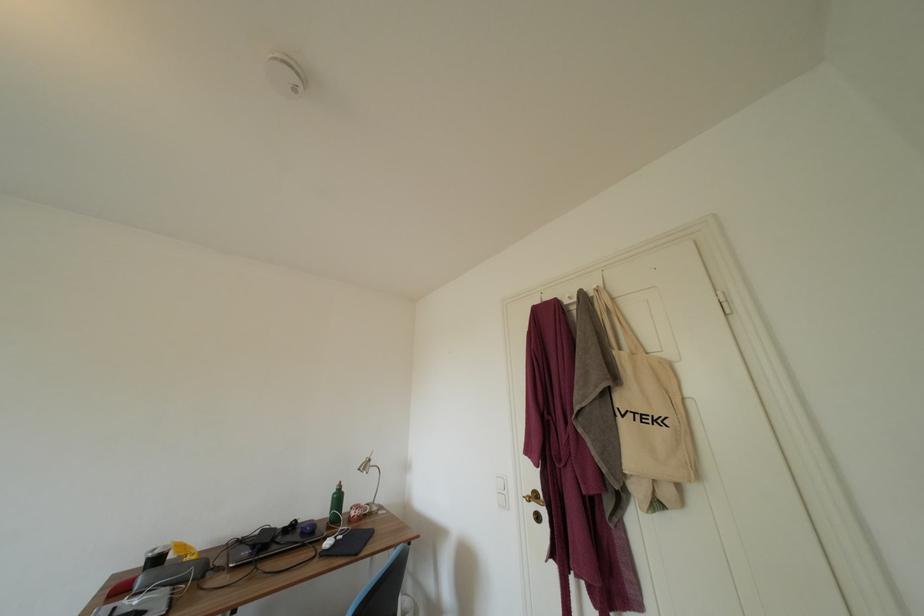
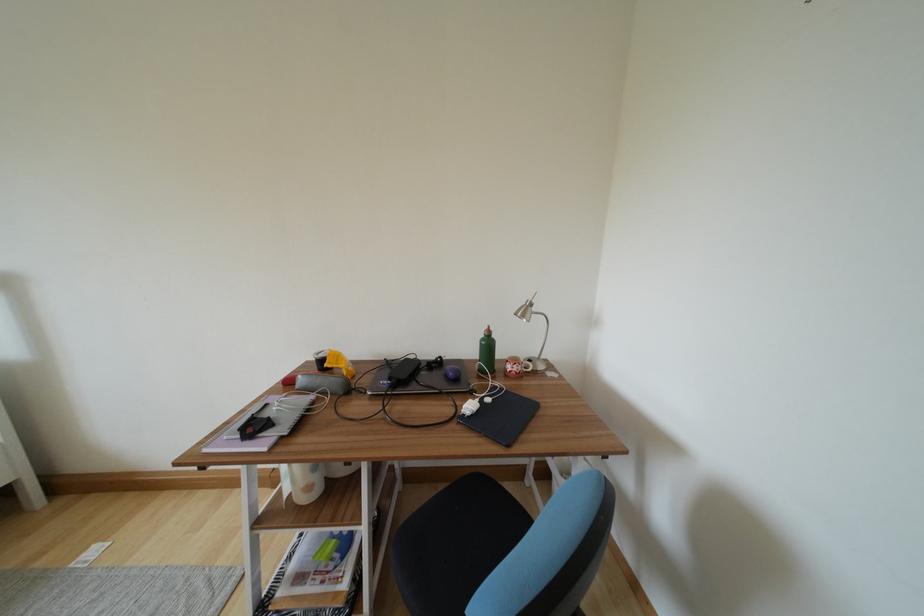
Find the pixel in the second image that matches [304,535] in the first image.

(448, 376)